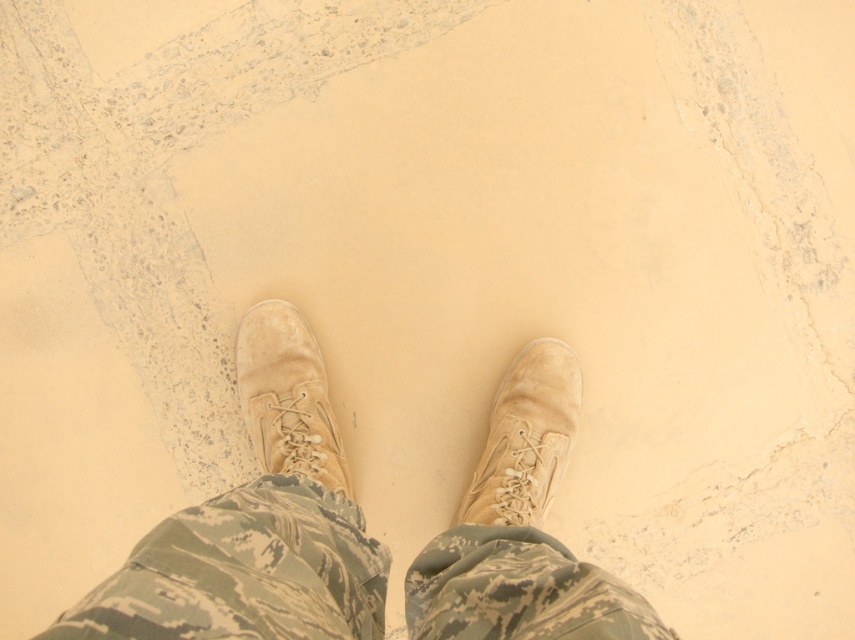
You are a hiker trying to determine the best footwear for navigating the sandy terrain shown in the image. The scene includes tan suede boots at center and suede boot at center. Which of these two footwear options is taller?

The tan suede boots at center is shorter than the suede boot at center, so the suede boot at center is taller and would provide more ankle support for navigating the sandy terrain shown in the image.